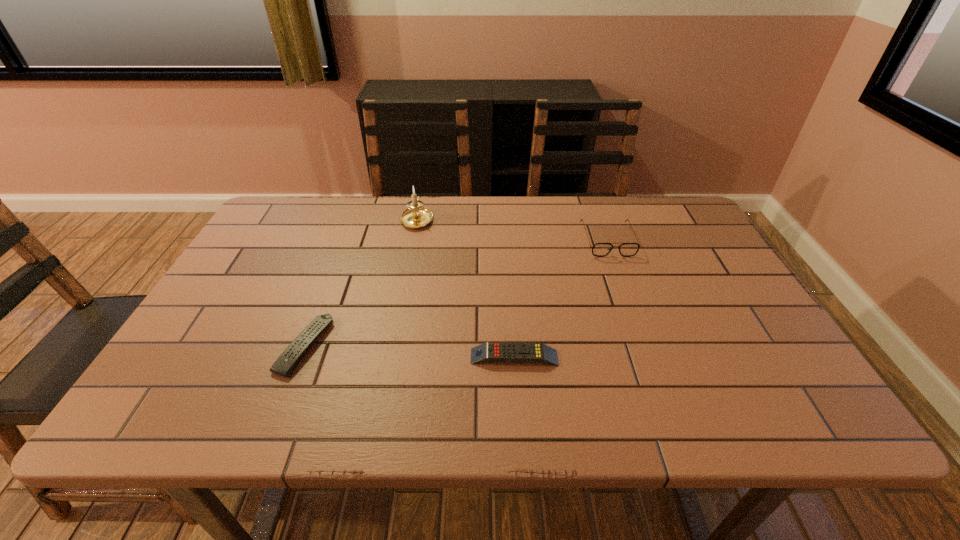
The width and height of the screenshot is (960, 540). Identify the location of candle holder. (417, 216).

Locate an element on the screen. the tallest object is located at coordinates (417, 216).

Where is `the rightmost object`? the rightmost object is located at coordinates (599, 249).

Where is `the third shortest object`? the third shortest object is located at coordinates (599, 249).

The image size is (960, 540). In order to click on the second object from right to left in this screenshot , I will do `click(506, 352)`.

I want to click on the leftmost object, so [x=283, y=366].

Find the location of a particular element. This screenshot has width=960, height=540. vacant space located 0.060m on the handle side of the third object from right to left is located at coordinates (421, 197).

Image resolution: width=960 pixels, height=540 pixels. Find the location of `free space located 0.060m on the front-facing side of the second tallest object`. free space located 0.060m on the front-facing side of the second tallest object is located at coordinates (619, 271).

The image size is (960, 540). In order to click on free spot located 0.250m on the left of the third object from left to right in this screenshot , I will do `click(355, 357)`.

You are a GUI agent. You are given a task and a screenshot of the screen. Output one action in this format:
    pyautogui.click(x=<x>, y=<y>)
    Task: Click on the vacant space situated on the right of the leftmost object
    The height and width of the screenshot is (540, 960).
    Given the screenshot: What is the action you would take?
    click(x=484, y=346)